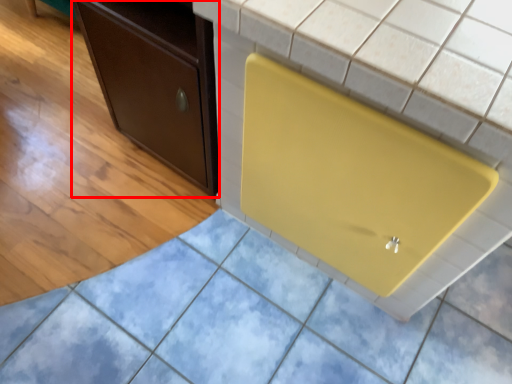
Question: From the image's perspective, what is the correct spatial relationship of cabinetry (annotated by the red box) in relation to appliance?

Choices:
 (A) below
 (B) above

Answer: (B)